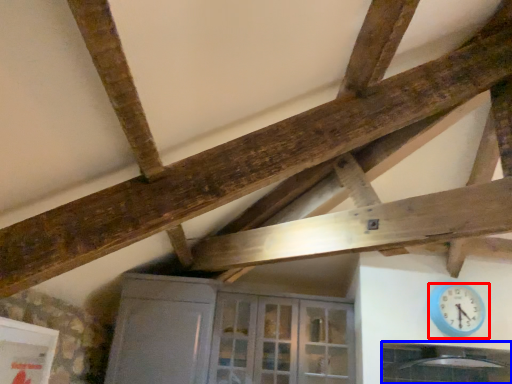
Question: Which object appears farthest to the camera in this image, wall clock (highlighted by a red box) or window (highlighted by a blue box)?

Choices:
 (A) wall clock
 (B) window

Answer: (A)